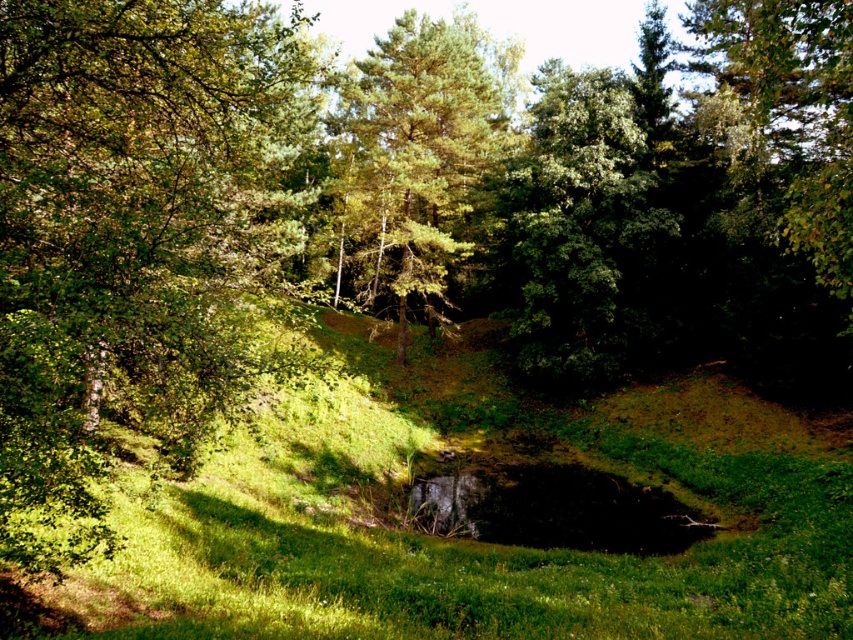
Question: Can you confirm if green grass at center is positioned above green leafy tree at left?

Choices:
 (A) no
 (B) yes

Answer: (A)

Question: Does green leafy tree at center have a larger size compared to green matte tree at center?

Choices:
 (A) no
 (B) yes

Answer: (A)

Question: Among these objects, which one is farthest from the camera?

Choices:
 (A) green matte tree at center
 (B) green grass at center
 (C) green leafy tree at left
 (D) green leafy tree at center

Answer: (A)

Question: Which point appears closest to the camera in this image?

Choices:
 (A) (662, 96)
 (B) (318, 492)
 (C) (264, 118)
 (D) (453, 259)

Answer: (C)

Question: Considering the relative positions of green grass at center and green leafy tree at center in the image provided, where is green grass at center located with respect to green leafy tree at center?

Choices:
 (A) below
 (B) above

Answer: (A)

Question: Which point is closer to the camera taking this photo?

Choices:
 (A) (264, 634)
 (B) (276, 93)
 (C) (426, 273)
 (D) (547, 365)

Answer: (A)